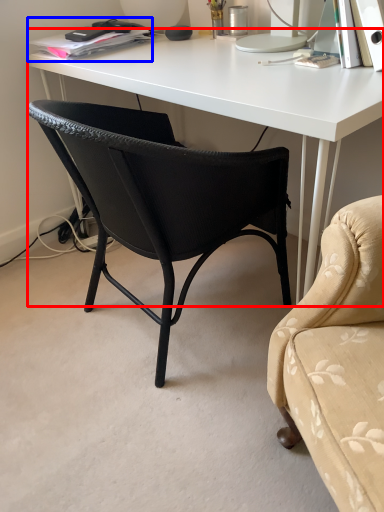
Question: Which object is closer to the camera taking this photo, desk (highlighted by a red box) or book (highlighted by a blue box)?

Choices:
 (A) desk
 (B) book

Answer: (A)